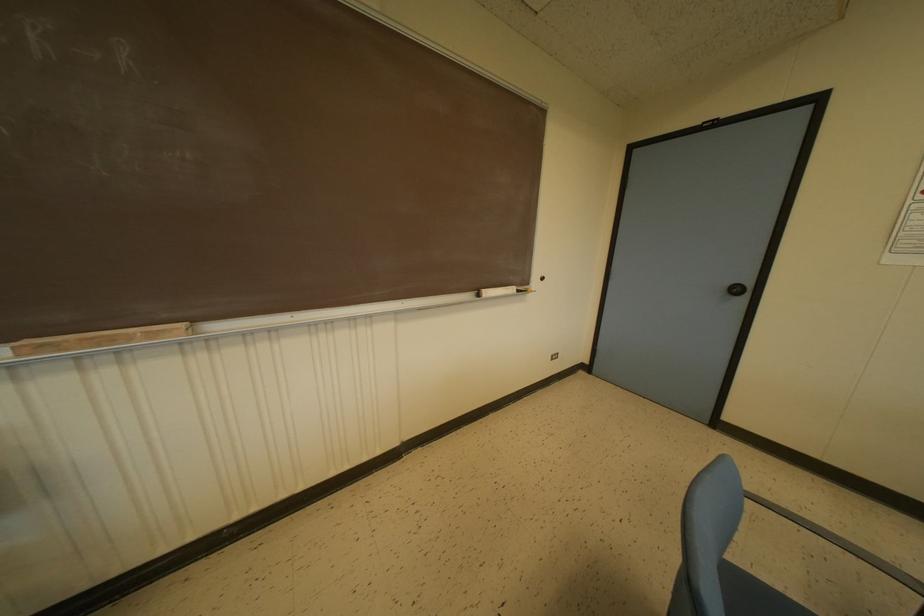
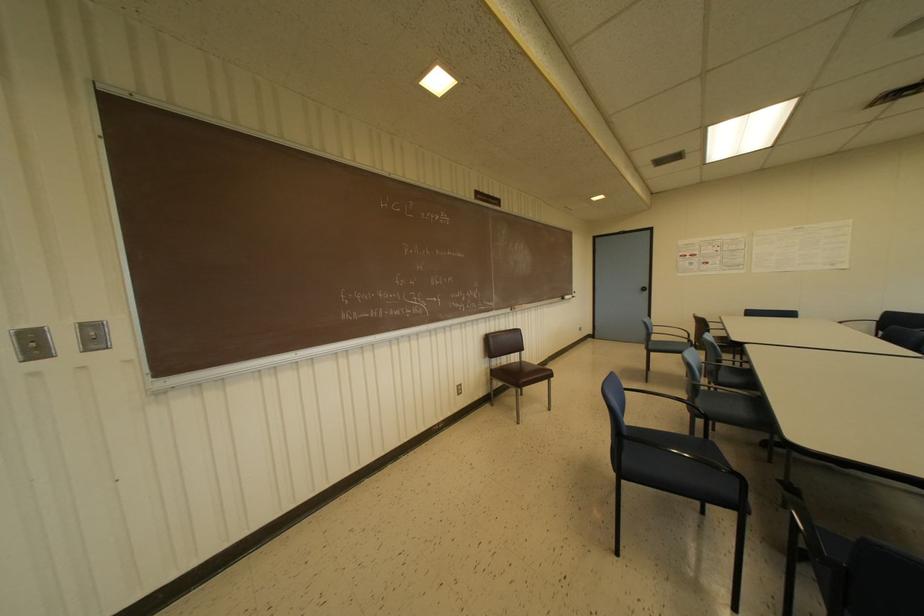
In the second image, find the point that corresponds to (746,291) in the first image.

(646, 288)